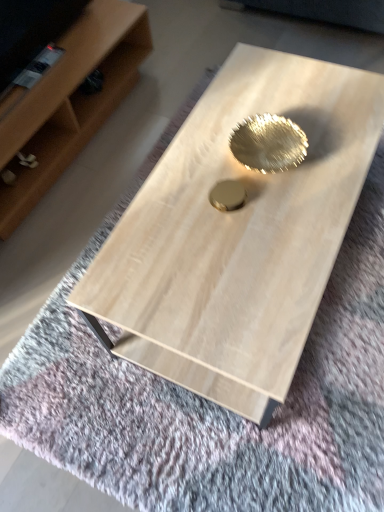
I want to click on blank space situated above light wood shelf at upper left (from a real-world perspective), so click(x=49, y=61).